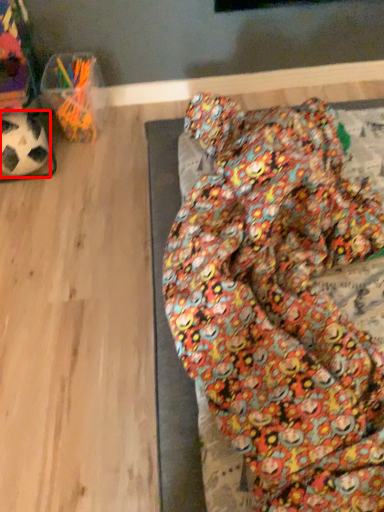
Question: From the image's perspective, what is the correct spatial relationship of football (annotated by the red box) in relation to bean bag chair?

Choices:
 (A) below
 (B) above

Answer: (B)